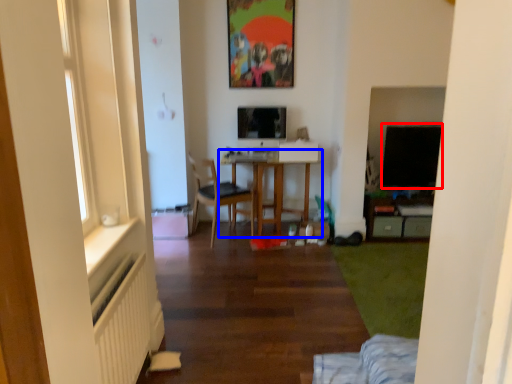
Question: Among these objects, which one is farthest to the camera, window screen (highlighted by a red box) or table (highlighted by a blue box)?

Choices:
 (A) window screen
 (B) table

Answer: (A)